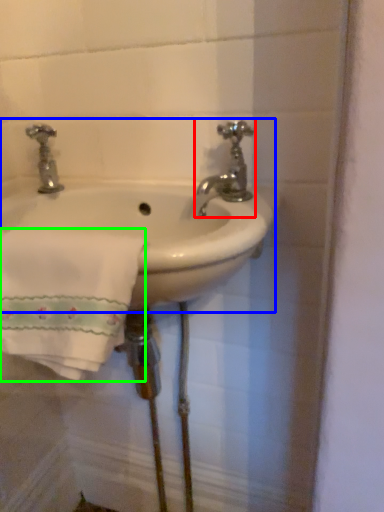
Question: Considering the real-world distances, which object is closest to tap (highlighted by a red box)? sink (highlighted by a blue box) or bath towel (highlighted by a green box).

Choices:
 (A) sink
 (B) bath towel

Answer: (A)